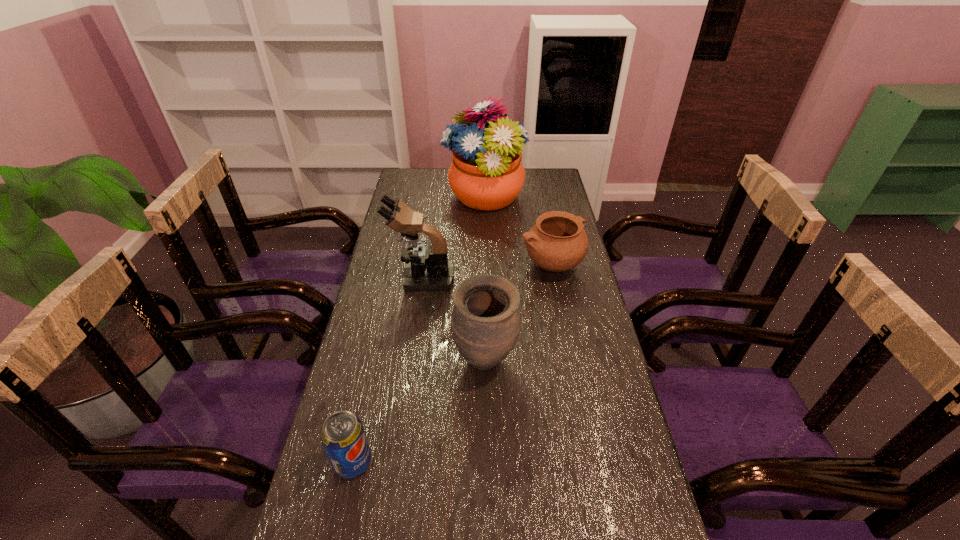
This screenshot has width=960, height=540. I want to click on vacant area that lies between the soda and the fourth shortest object, so click(388, 370).

At what (x,y) coordinates should I click in order to perform the action: click on empty location between the pottery and the soda. Please return your answer as a coordinate pair (x, y). Looking at the image, I should click on (452, 363).

This screenshot has width=960, height=540. Find the location of `free space that is in between the soda and the flower arrangement`. free space that is in between the soda and the flower arrangement is located at coordinates (419, 330).

What are the coordinates of `free point between the tallest object and the pottery` in the screenshot? It's located at (517, 232).

Locate an element on the screen. The height and width of the screenshot is (540, 960). vacant area that lies between the pottery and the microscope is located at coordinates (487, 272).

The image size is (960, 540). Identify the location of free spot between the pottery and the soda. (452, 363).

The width and height of the screenshot is (960, 540). Identify the location of free spot between the third shortest object and the nearest object. (420, 411).

This screenshot has width=960, height=540. I want to click on free space between the nearest object and the pottery, so click(x=452, y=363).

Locate an element on the screen. This screenshot has height=540, width=960. the fourth closest object relative to the pottery is located at coordinates (343, 437).

Identify the location of object that can be found as the closest to the third shortest object. The width and height of the screenshot is (960, 540). (427, 269).